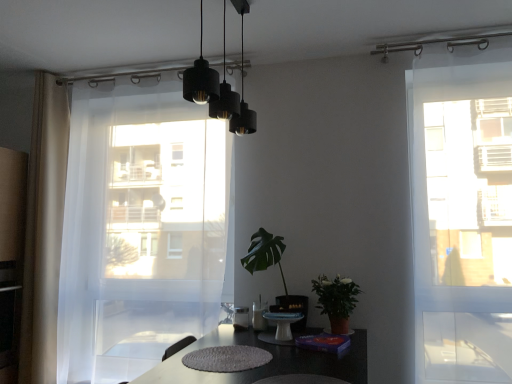
Question: Does white sheer curtain at left, placed as the second curtain when sorted from left to right, have a lesser width compared to white sheer curtain at left, marked as the second curtain in a right-to-left arrangement?

Choices:
 (A) yes
 (B) no

Answer: (B)

Question: Would you consider white sheer curtain at left, placed as the second curtain when sorted from left to right, to be distant from white sheer curtain at left, marked as the second curtain in a right-to-left arrangement?

Choices:
 (A) no
 (B) yes

Answer: (A)

Question: Can you confirm if white sheer curtain at left, positioned as the first curtain in right-to-left order, is smaller than white sheer curtain at left, which is counted as the first curtain, starting from the left?

Choices:
 (A) no
 (B) yes

Answer: (A)

Question: Considering the relative positions of white sheer curtain at left, positioned as the first curtain in right-to-left order, and white sheer curtain at left, marked as the second curtain in a right-to-left arrangement, in the image provided, is white sheer curtain at left, positioned as the first curtain in right-to-left order, to the right of white sheer curtain at left, marked as the second curtain in a right-to-left arrangement, from the viewer's perspective?

Choices:
 (A) no
 (B) yes

Answer: (B)

Question: Could you tell me if white sheer curtain at left, placed as the second curtain when sorted from left to right, is facing white sheer curtain at left, which is counted as the first curtain, starting from the left?

Choices:
 (A) yes
 (B) no

Answer: (B)

Question: Considering the positions of white sheer curtain at left, marked as the second curtain in a right-to-left arrangement, and white sheer curtain at left, placed as the second curtain when sorted from left to right, in the image, is white sheer curtain at left, marked as the second curtain in a right-to-left arrangement, wider or thinner than white sheer curtain at left, placed as the second curtain when sorted from left to right,?

Choices:
 (A) wide
 (B) thin

Answer: (B)

Question: In terms of size, does white sheer curtain at left, marked as the second curtain in a right-to-left arrangement, appear bigger or smaller than white sheer curtain at left, placed as the second curtain when sorted from left to right?

Choices:
 (A) small
 (B) big

Answer: (A)

Question: In the image, is white sheer curtain at left, marked as the second curtain in a right-to-left arrangement, on the left side or the right side of white sheer curtain at left, placed as the second curtain when sorted from left to right?

Choices:
 (A) left
 (B) right

Answer: (A)

Question: From a real-world perspective, is white sheer curtain at left, marked as the second curtain in a right-to-left arrangement, physically located above or below white sheer curtain at left, placed as the second curtain when sorted from left to right?

Choices:
 (A) below
 (B) above

Answer: (B)

Question: Is green matte plant at center-right, the 1th houseplant viewed from the right, inside the boundaries of green leafy plant at center, which appears as the first houseplant when viewed from the left, or outside?

Choices:
 (A) inside
 (B) outside

Answer: (B)

Question: Considering the positions of green matte plant at center-right, the 1th houseplant viewed from the right, and green leafy plant at center, which is the second houseplant from right to left, in the image, is green matte plant at center-right, the 1th houseplant viewed from the right, bigger or smaller than green leafy plant at center, which is the second houseplant from right to left,?

Choices:
 (A) big
 (B) small

Answer: (B)

Question: In the image, is green matte plant at center-right, marked as the second houseplant in a left-to-right arrangement, on the left side or the right side of green leafy plant at center, which appears as the first houseplant when viewed from the left?

Choices:
 (A) right
 (B) left

Answer: (A)

Question: Considering the positions of point (329, 284) and point (275, 309), is point (329, 284) closer or farther from the camera than point (275, 309)?

Choices:
 (A) farther
 (B) closer

Answer: (B)

Question: From the image's perspective, is green leafy plant at center, which appears as the first houseplant when viewed from the left, above or below white sheer curtain at left, placed as the second curtain when sorted from left to right?

Choices:
 (A) below
 (B) above

Answer: (A)

Question: From their relative heights in the image, would you say green leafy plant at center, which appears as the first houseplant when viewed from the left, is taller or shorter than white sheer curtain at left, positioned as the first curtain in right-to-left order?

Choices:
 (A) tall
 (B) short

Answer: (B)